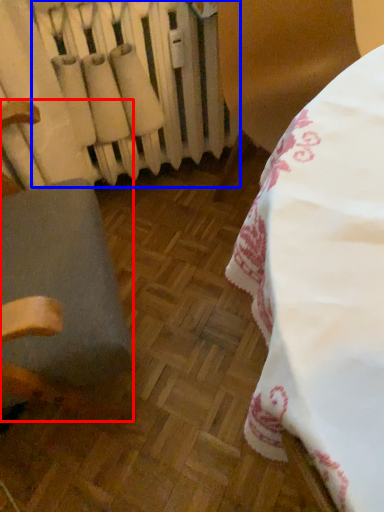
Question: Which point is further to the camera, furniture (highlighted by a red box) or radiator (highlighted by a blue box)?

Choices:
 (A) furniture
 (B) radiator

Answer: (B)